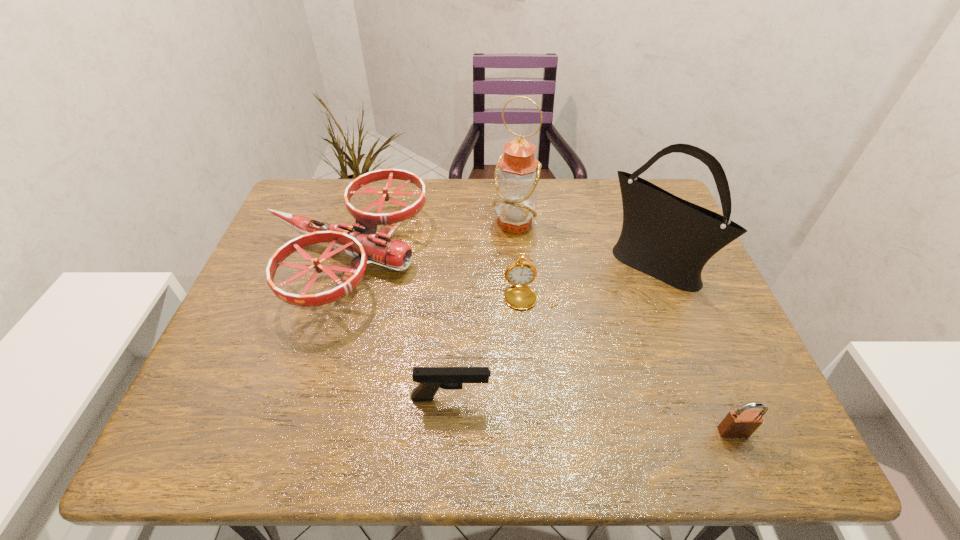
In the image, there is a desktop. Where is `free space at the far edge`? The image size is (960, 540). free space at the far edge is located at coordinates (452, 186).

This screenshot has height=540, width=960. In order to click on blank space at the near edge in this screenshot , I will do `click(416, 455)`.

Where is `free spot between the second nearest object and the leftmost object`? This screenshot has width=960, height=540. free spot between the second nearest object and the leftmost object is located at coordinates [x=397, y=328].

The image size is (960, 540). What are the coordinates of `empty location between the shoulder bag and the oil lamp` in the screenshot? It's located at (583, 245).

Where is `free spot between the shoulder bag and the oil lamp`? This screenshot has height=540, width=960. free spot between the shoulder bag and the oil lamp is located at coordinates (583, 245).

Where is `vacant area between the fifth farthest object and the leftmost object`? The image size is (960, 540). vacant area between the fifth farthest object and the leftmost object is located at coordinates (397, 328).

You are a GUI agent. You are given a task and a screenshot of the screen. Output one action in this format:
    pyautogui.click(x=<x>, y=<y>)
    Task: Click on the free spot between the fifth farthest object and the nearest object
    The height and width of the screenshot is (540, 960).
    Given the screenshot: What is the action you would take?
    pyautogui.click(x=592, y=415)

Where is `unoccupied area between the fifth object from right to left and the shoulder bag`? This screenshot has width=960, height=540. unoccupied area between the fifth object from right to left and the shoulder bag is located at coordinates (551, 332).

Find the location of `free spot between the nearest object and the pocket watch`. free spot between the nearest object and the pocket watch is located at coordinates (632, 363).

This screenshot has height=540, width=960. Find the location of `empty space that is in between the shoulder bag and the oil lamp`. empty space that is in between the shoulder bag and the oil lamp is located at coordinates (583, 245).